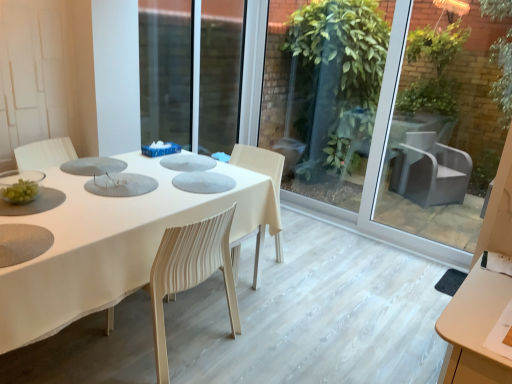
Question: Should I look upward or downward to see white fabric table at center?

Choices:
 (A) up
 (B) down

Answer: (B)

Question: Can you confirm if transparent glass door at center is taller than white striped fabric chair at center?

Choices:
 (A) yes
 (B) no

Answer: (A)

Question: Is transparent glass door at center beside white striped fabric chair at center?

Choices:
 (A) yes
 (B) no

Answer: (B)

Question: Can you confirm if transparent glass door at center is positioned to the right of white striped fabric chair at center?

Choices:
 (A) no
 (B) yes

Answer: (B)

Question: Can you confirm if transparent glass door at center is wider than white striped fabric chair at center?

Choices:
 (A) yes
 (B) no

Answer: (B)

Question: From a real-world perspective, is transparent glass door at center positioned over white striped fabric chair at center based on gravity?

Choices:
 (A) no
 (B) yes

Answer: (B)

Question: Can you confirm if transparent glass door at center is shorter than white striped fabric chair at center?

Choices:
 (A) yes
 (B) no

Answer: (B)

Question: Is white striped fabric chair at center not within transparent glass door at center?

Choices:
 (A) no
 (B) yes

Answer: (B)

Question: From a real-world perspective, is white striped fabric chair at center located beneath transparent glass door at center?

Choices:
 (A) yes
 (B) no

Answer: (A)

Question: Considering the relative positions of white striped fabric chair at center and transparent glass door at center in the image provided, is white striped fabric chair at center to the left of transparent glass door at center from the viewer's perspective?

Choices:
 (A) yes
 (B) no

Answer: (A)

Question: Does white striped fabric chair at center have a lesser width compared to transparent glass door at center?

Choices:
 (A) yes
 (B) no

Answer: (B)

Question: Is the depth of white striped fabric chair at center greater than that of transparent glass door at center?

Choices:
 (A) no
 (B) yes

Answer: (A)

Question: Is white striped fabric chair at center facing away from transparent glass door at center?

Choices:
 (A) yes
 (B) no

Answer: (B)

Question: From the image's perspective, is transparent glass door at center on white fabric table at center?

Choices:
 (A) yes
 (B) no

Answer: (A)